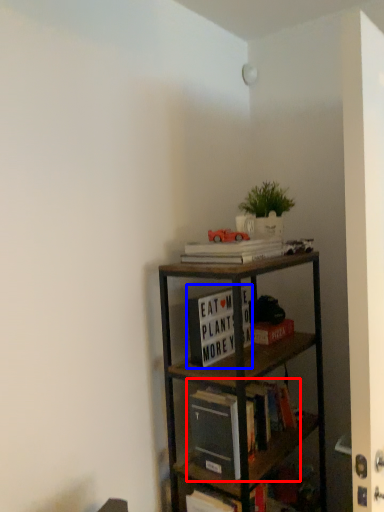
Question: Which object appears farthest to the camera in this image, book (highlighted by a red box) or book (highlighted by a blue box)?

Choices:
 (A) book
 (B) book

Answer: (B)